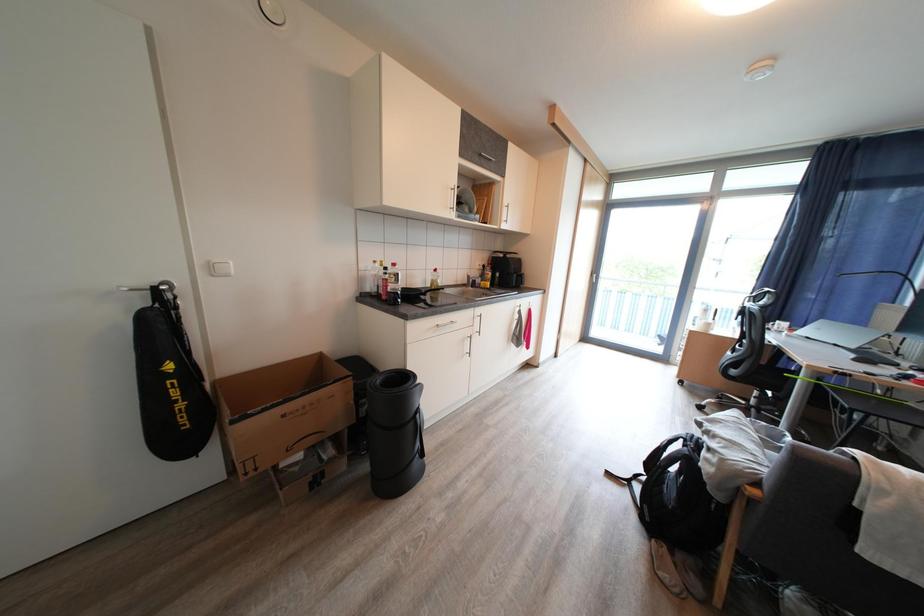
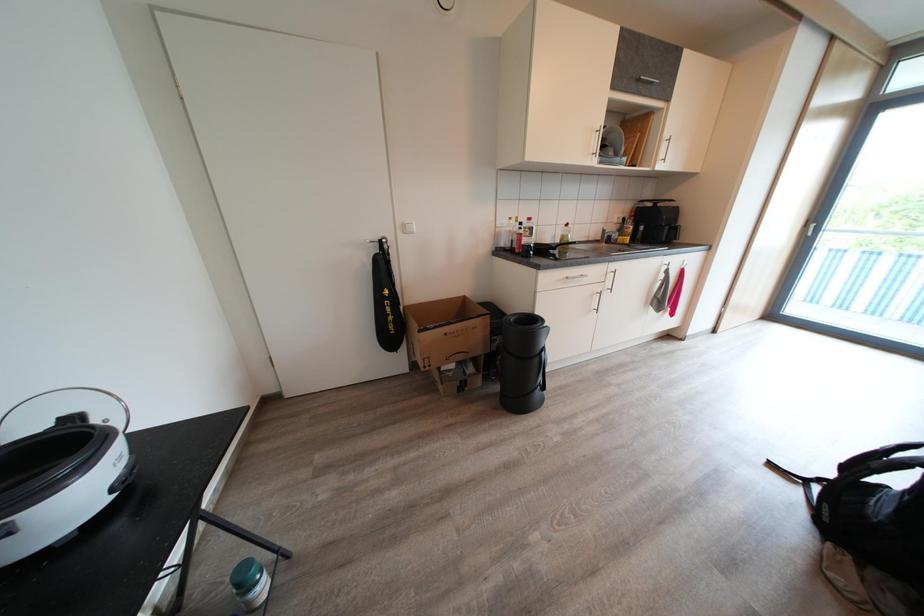
Question: The camera is either moving clockwise (left) or counter-clockwise (right) around the object. The first image is from the beginning of the video and the second image is from the end. Is the camera moving left or right when shooting the video?

Choices:
 (A) Left
 (B) Right

Answer: (B)